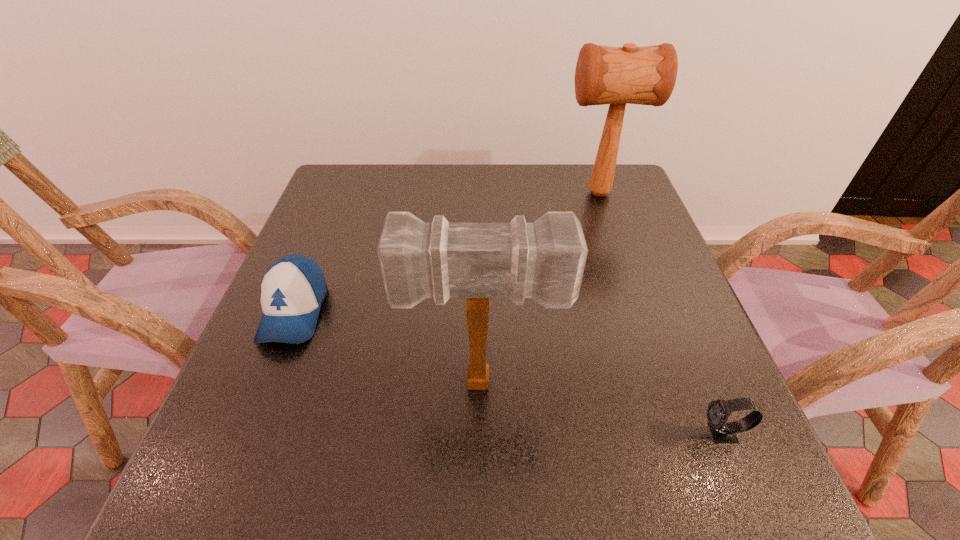
I want to click on vacant space located on the back of the second object from left to right, so click(x=481, y=317).

Image resolution: width=960 pixels, height=540 pixels. I want to click on vacant space located on the front-facing side of the third nearest object, so click(x=223, y=489).

This screenshot has width=960, height=540. I want to click on vacant space located on the face of the nearest object, so click(517, 434).

Find the location of a particular element. This screenshot has height=540, width=960. free space located 0.360m on the face of the nearest object is located at coordinates (481, 434).

Locate an element on the screen. free space located on the face of the nearest object is located at coordinates (468, 434).

At what (x,y) coordinates should I click in order to perform the action: click on object at the far edge. Please return your answer as a coordinate pair (x, y). The width and height of the screenshot is (960, 540). Looking at the image, I should click on (646, 75).

Find the location of a particular element. object positioned at the left edge is located at coordinates (292, 290).

Locate an element on the screen. mallet that is at the right edge is located at coordinates tap(646, 75).

In order to click on watch that is at the right edge in this screenshot , I will do `click(718, 411)`.

At what (x,y) coordinates should I click in order to perform the action: click on object located in the far right corner section of the desktop. Please return your answer as a coordinate pair (x, y). The width and height of the screenshot is (960, 540). Looking at the image, I should click on (646, 75).